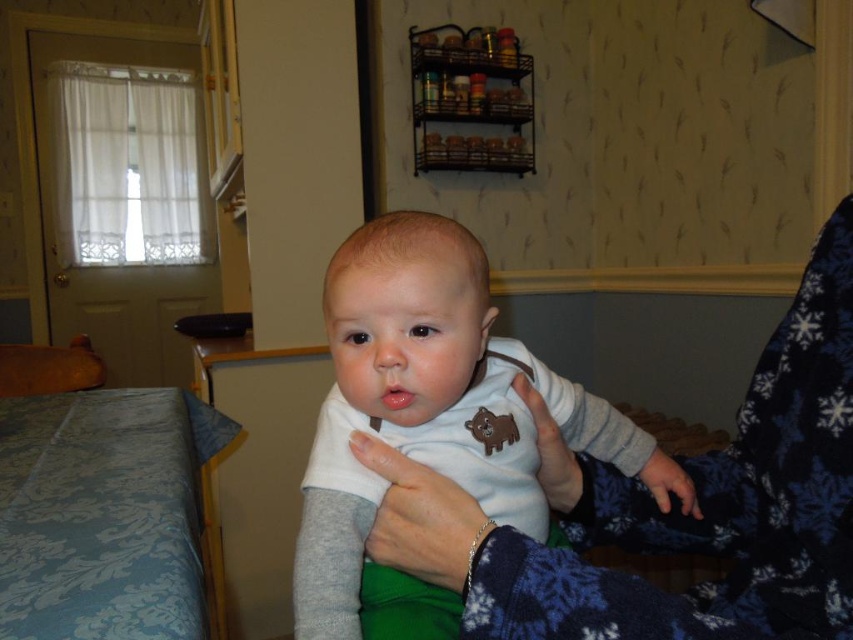
Question: Does white soft onesie at center have a larger size compared to soft blue fabric hand at lower right?

Choices:
 (A) no
 (B) yes

Answer: (B)

Question: Which of the following is the farthest from the observer?

Choices:
 (A) (654, 484)
 (B) (366, 444)
 (C) (323, 616)
 (D) (213, 593)

Answer: (D)

Question: Is white soft onesie at center wider than blue damask fabric bed at lower left?

Choices:
 (A) no
 (B) yes

Answer: (B)

Question: Which of the following is the farthest from the observer?

Choices:
 (A) blue damask fabric bed at lower left
 (B) white soft onesie at center

Answer: (A)

Question: Which is farther from the soft blue fabric hand at lower right?

Choices:
 (A) white soft onesie at center
 (B) blue damask fabric bed at lower left

Answer: (B)

Question: From the image, what is the correct spatial relationship of white soft onesie at center in relation to soft blue fabric hand at lower right?

Choices:
 (A) right
 (B) left

Answer: (B)